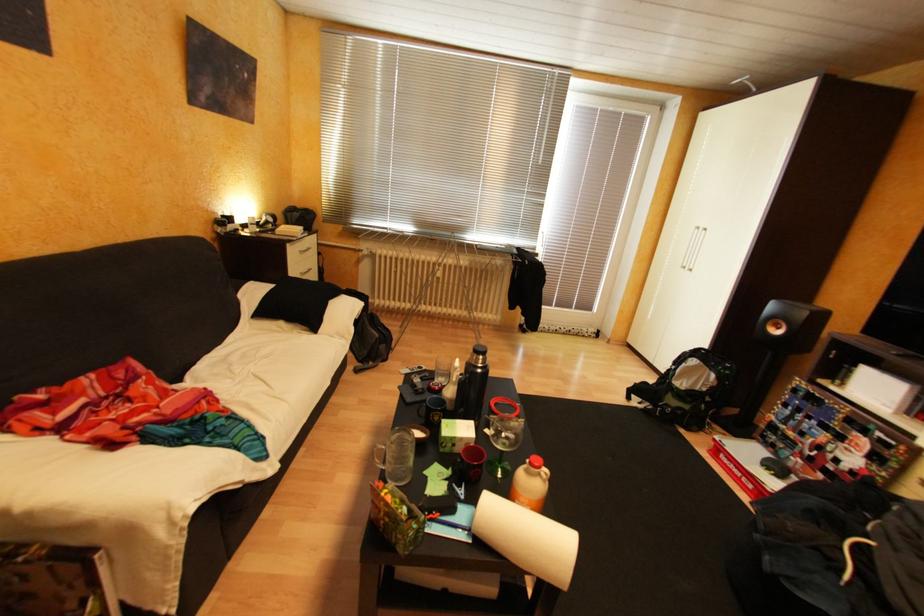
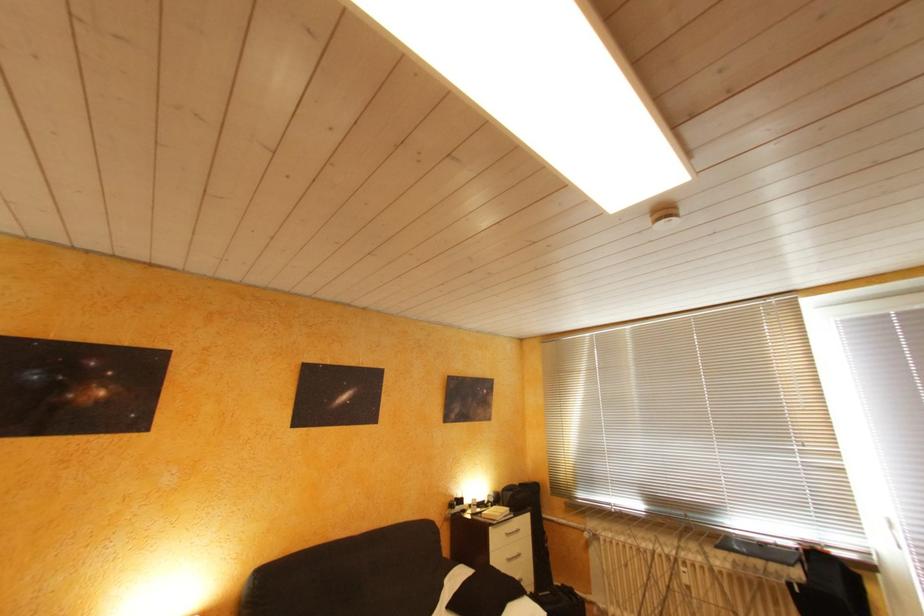
Based on the continuous images, in which direction is the camera rotating?

The camera's rotation is toward left-up.